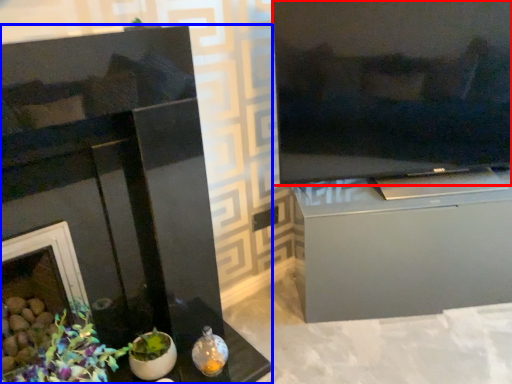
Question: Which object appears closest to the camera in this image, television (highlighted by a red box) or fireplace (highlighted by a blue box)?

Choices:
 (A) television
 (B) fireplace

Answer: (B)